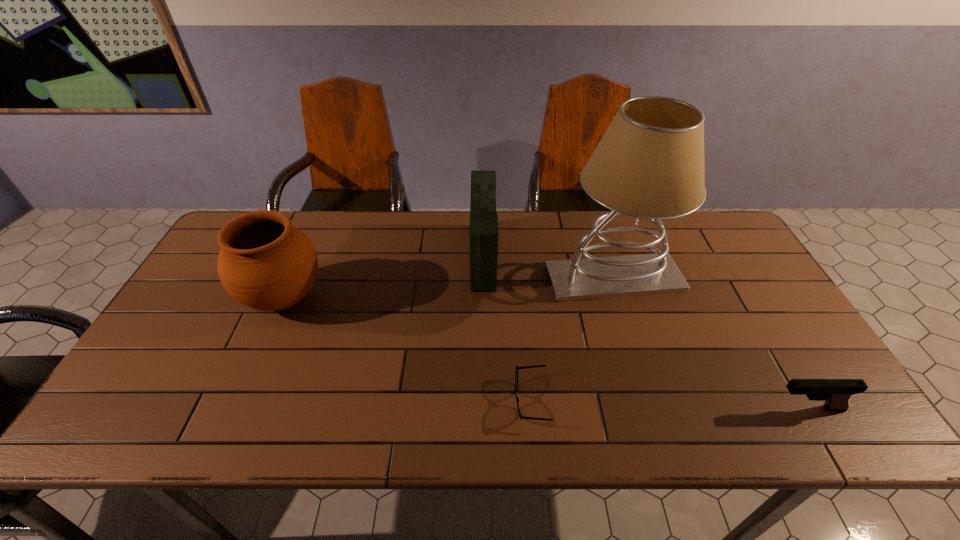
You are a GUI agent. You are given a task and a screenshot of the screen. Output one action in this format:
    pyautogui.click(x=<x>, y=<y>)
    Task: Click on the second object from right to left
    
    Given the screenshot: What is the action you would take?
    pyautogui.click(x=649, y=164)

The width and height of the screenshot is (960, 540). Identify the location of table lamp. (649, 164).

The height and width of the screenshot is (540, 960). Find the location of `the leftmost object`. the leftmost object is located at coordinates coord(265,263).

I want to click on the first-aid kit, so click(x=483, y=218).

I want to click on the second shortest object, so click(x=836, y=393).

Locate an element on the screen. The height and width of the screenshot is (540, 960). pistol is located at coordinates (836, 393).

Find the location of a particular element. The width and height of the screenshot is (960, 540). the shortest object is located at coordinates (524, 367).

The image size is (960, 540). Identify the location of the third object from left to right. (524, 367).

Where is `free space located on the right of the table lamp`? free space located on the right of the table lamp is located at coordinates (722, 279).

Locate an element on the screen. vacant position located 0.180m on the front of the pottery is located at coordinates (244, 392).